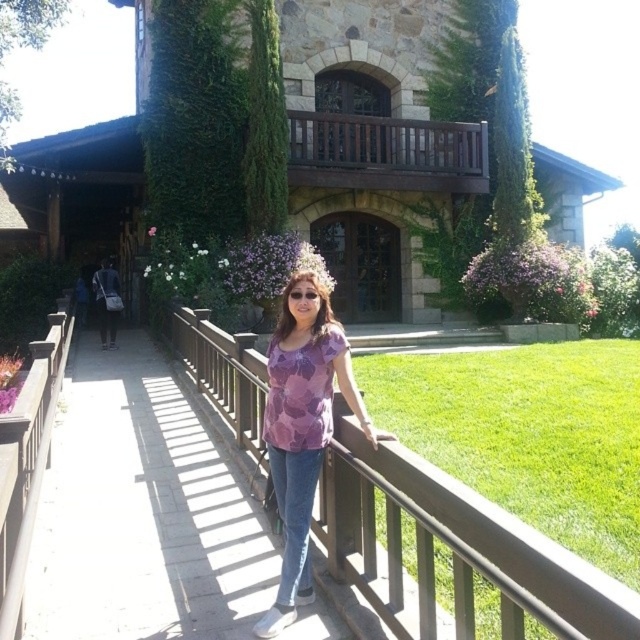
Question: Does wooden bridge at center have a lesser width compared to brown wooden balustrade at upper center?

Choices:
 (A) yes
 (B) no

Answer: (A)

Question: Which object is farther from the camera taking this photo?

Choices:
 (A) wooden bridge at center
 (B) purple printed shirt at center
 (C) brown wooden balustrade at upper center

Answer: (C)

Question: Does wooden at center have a greater width compared to purple printed shirt at center?

Choices:
 (A) yes
 (B) no

Answer: (A)

Question: Is wooden bridge at center to the left of brown wooden balustrade at upper center from the viewer's perspective?

Choices:
 (A) yes
 (B) no

Answer: (A)

Question: Which of the following is the closest to the observer?

Choices:
 (A) purple printed shirt at center
 (B) brown wooden balustrade at upper center

Answer: (A)

Question: Which object is closer to the camera taking this photo?

Choices:
 (A) wooden at center
 (B) purple printed shirt at center
 (C) wooden bridge at center
 (D) brown wooden balustrade at upper center

Answer: (A)